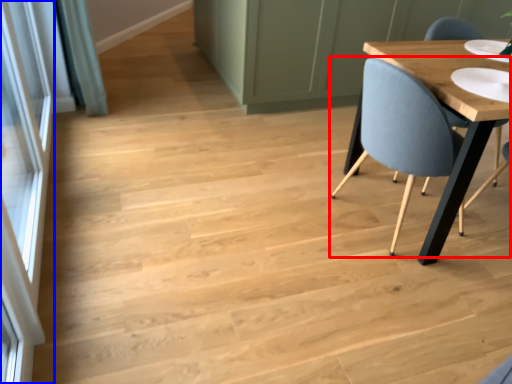
Question: Among these objects, which one is nearest to the camera, chair (highlighted by a red box) or screen door (highlighted by a blue box)?

Choices:
 (A) chair
 (B) screen door

Answer: (B)